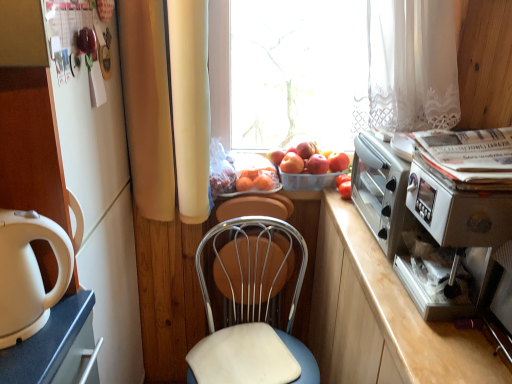
Question: Which direction should I rotate to face red matte apple at center, placed as the 3th apple when sorted from right to left, — up or down?

Choices:
 (A) down
 (B) up

Answer: (B)

Question: Can we say metallic silver swivel chair at center lies outside white glossy cabinet at left?

Choices:
 (A) no
 (B) yes

Answer: (B)

Question: From a real-world perspective, is metallic silver swivel chair at center positioned over white glossy cabinet at left based on gravity?

Choices:
 (A) no
 (B) yes

Answer: (A)

Question: Is metallic silver swivel chair at center oriented towards white glossy cabinet at left?

Choices:
 (A) no
 (B) yes

Answer: (A)

Question: Does metallic silver swivel chair at center appear on the right side of white glossy cabinet at left?

Choices:
 (A) no
 (B) yes

Answer: (B)

Question: Does metallic silver swivel chair at center have a lesser width compared to white glossy cabinet at left?

Choices:
 (A) no
 (B) yes

Answer: (B)

Question: Is metallic silver swivel chair at center positioned with its back to white glossy cabinet at left?

Choices:
 (A) no
 (B) yes

Answer: (A)

Question: From a real-world perspective, is transparent glass window at center beneath metallic silver swivel chair at center?

Choices:
 (A) yes
 (B) no

Answer: (B)

Question: Would you say transparent glass window at center is a long distance from metallic silver swivel chair at center?

Choices:
 (A) no
 (B) yes

Answer: (A)

Question: Considering the relative positions of transparent glass window at center and metallic silver swivel chair at center in the image provided, is transparent glass window at center to the right of metallic silver swivel chair at center from the viewer's perspective?

Choices:
 (A) no
 (B) yes

Answer: (B)

Question: Is metallic silver swivel chair at center at the back of transparent glass window at center?

Choices:
 (A) no
 (B) yes

Answer: (A)

Question: Considering the relative sizes of transparent glass window at center and metallic silver swivel chair at center in the image provided, is transparent glass window at center bigger than metallic silver swivel chair at center?

Choices:
 (A) yes
 (B) no

Answer: (A)

Question: Does transparent glass window at center appear on the left side of metallic silver swivel chair at center?

Choices:
 (A) no
 (B) yes

Answer: (A)

Question: Is orange matte at center further to camera compared to metallic silver toaster oven at right?

Choices:
 (A) yes
 (B) no

Answer: (A)